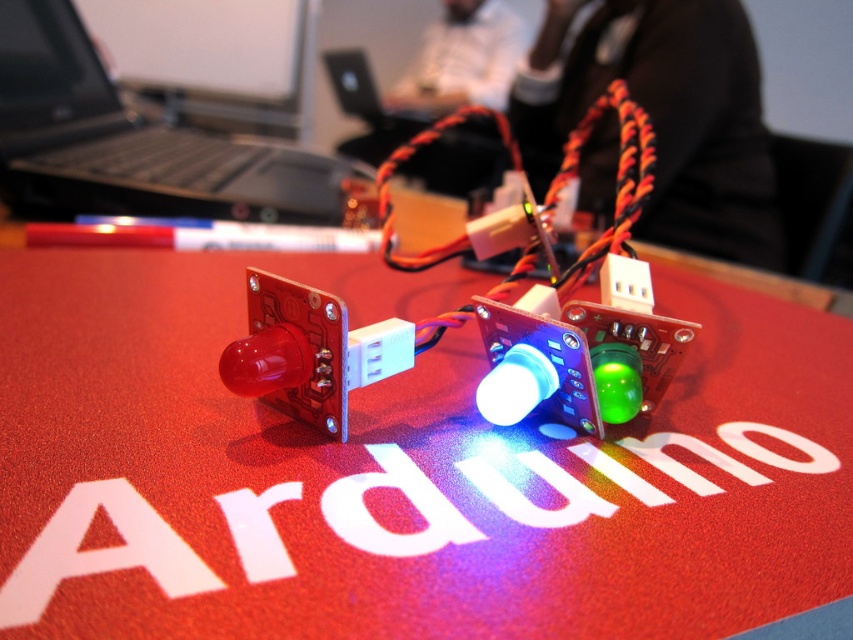
Question: Can you confirm if red matte arduino board at center is smaller than black plastic laptop at upper left?

Choices:
 (A) no
 (B) yes

Answer: (A)

Question: Which point is closer to the camera?

Choices:
 (A) (68, 38)
 (B) (91, 602)

Answer: (B)

Question: Does red matte arduino board at center have a smaller size compared to black plastic laptop at upper left?

Choices:
 (A) no
 (B) yes

Answer: (A)

Question: Which point is farther to the camera?

Choices:
 (A) black plastic laptop at upper left
 (B) red matte arduino board at center

Answer: (A)

Question: Can you confirm if red matte arduino board at center is thinner than black plastic laptop at upper left?

Choices:
 (A) no
 (B) yes

Answer: (A)

Question: Among these points, which one is farthest from the camera?

Choices:
 (A) (793, 321)
 (B) (160, 173)

Answer: (B)